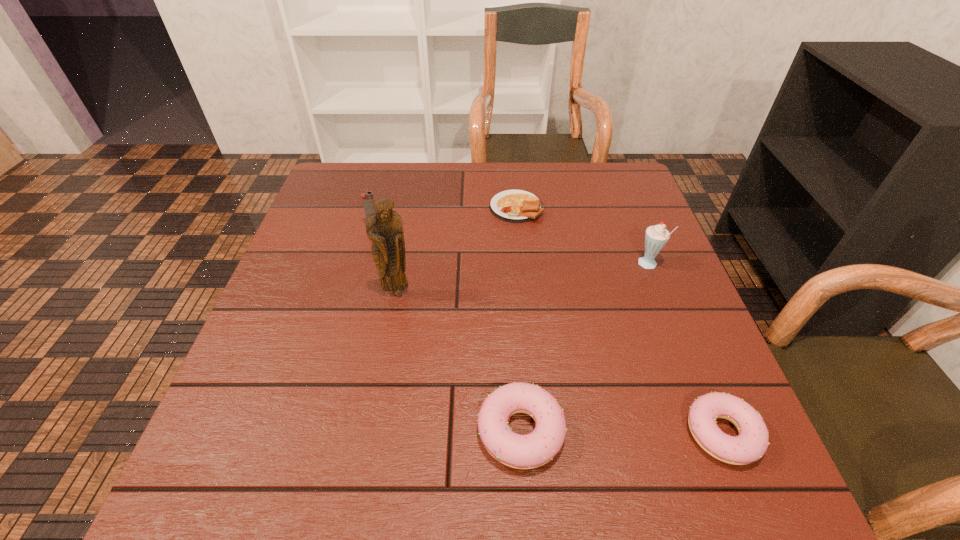
The image size is (960, 540). In order to click on vacant space that is in between the igniter and the second shortest object in this screenshot , I will do `click(548, 329)`.

Find the location of a particular element. Image resolution: width=960 pixels, height=540 pixels. vacant space in between the fourth tallest object and the igniter is located at coordinates (446, 328).

Locate an element on the screen. empty location between the third tallest object and the taller doughnut is located at coordinates (446, 328).

Locate an element on the screen. The image size is (960, 540). empty space between the tallest object and the third farthest object is located at coordinates (523, 279).

You are a GUI agent. You are given a task and a screenshot of the screen. Output one action in this format:
    pyautogui.click(x=<x>, y=<y>)
    Task: Click on the vacant point located between the third tallest object and the fourth nearest object
    The image size is (960, 540).
    Given the screenshot: What is the action you would take?
    pyautogui.click(x=511, y=246)

Where is `free spot between the fifth shortest object and the second shortest object`? This screenshot has height=540, width=960. free spot between the fifth shortest object and the second shortest object is located at coordinates (685, 349).

What are the coordinates of `unoccupied position between the figurine and the shorter doughnut` in the screenshot? It's located at (560, 363).

I want to click on empty space between the figurine and the taller doughnut, so click(x=459, y=362).

Where is `free spot between the second shortest object and the fourth tallest object`? free spot between the second shortest object and the fourth tallest object is located at coordinates click(621, 432).

Where is `free area in between the left doughnut and the igniter`? This screenshot has width=960, height=540. free area in between the left doughnut and the igniter is located at coordinates (446, 328).